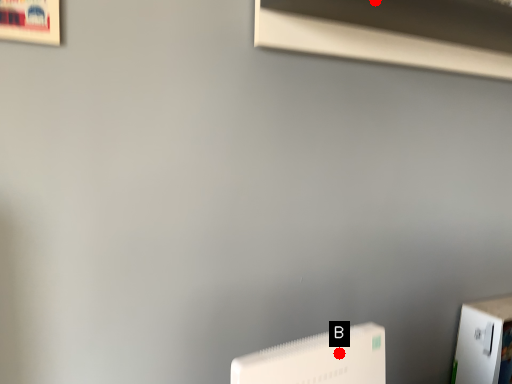
Question: Two points are circled on the image, labeled by A and B beside each circle. Which point is further to the camera?

Choices:
 (A) A is further
 (B) B is further

Answer: (A)